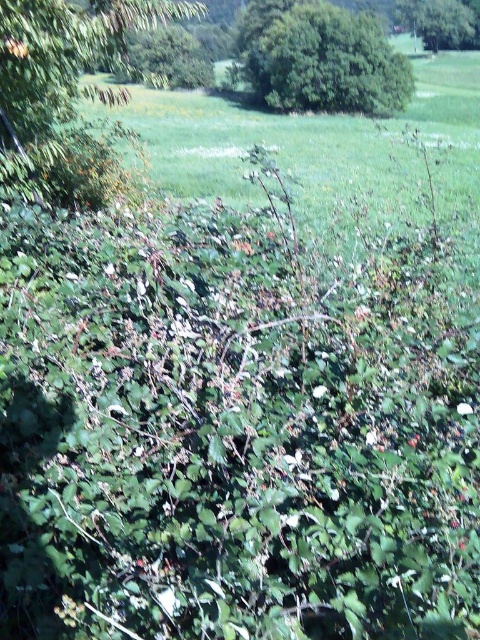
Question: Is green leafy bush at upper center thinner than green leafy tree at upper center?

Choices:
 (A) yes
 (B) no

Answer: (B)

Question: Is green leafy tree at upper left wider than green leafy bush at upper center?

Choices:
 (A) yes
 (B) no

Answer: (B)

Question: Which object is closer to the camera taking this photo?

Choices:
 (A) green leafy bush at upper center
 (B) green leafy tree at upper left
 (C) green leafy tree at upper center

Answer: (B)

Question: Which object appears farthest from the camera in this image?

Choices:
 (A) green leafy tree at upper left
 (B) green leafy tree at upper center
 (C) green leafy bush at upper center

Answer: (B)

Question: Which point is closer to the camera?

Choices:
 (A) green leafy tree at upper center
 (B) green leafy tree at upper left
 (C) green leafy bush at upper center

Answer: (B)

Question: Is green leafy tree at upper left closer to camera compared to green leafy bush at upper center?

Choices:
 (A) yes
 (B) no

Answer: (A)